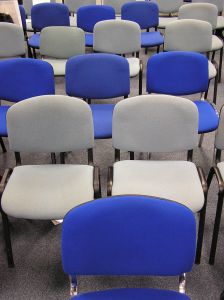
The width and height of the screenshot is (224, 300). I want to click on chairs in sixth row, so click(163, 20), click(117, 16), click(23, 15).